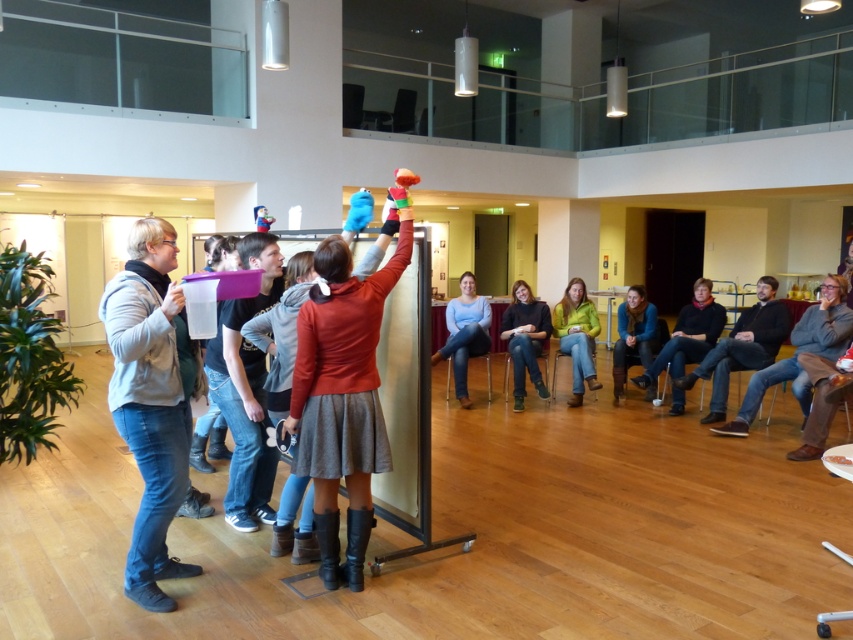
Question: Can you confirm if dark blue jeans at center is smaller than matte plastic toy at upper center?

Choices:
 (A) yes
 (B) no

Answer: (B)

Question: Can you confirm if reddish-brown leather jacket at center is thinner than blue scarf at lower right?

Choices:
 (A) yes
 (B) no

Answer: (B)

Question: Which point is farther to the camera?

Choices:
 (A) (517, 284)
 (B) (701, 292)
 (C) (387, 202)
 (D) (582, 346)

Answer: (A)

Question: Which of the following is the farthest from the observer?

Choices:
 (A) dark brown leather jacket at lower right
 (B) reddish-brown leather jacket at center
 (C) jeans at center
 (D) matte plastic toy at upper center

Answer: (C)

Question: Which object is positioned farthest from the blue scarf at lower right?

Choices:
 (A) blue jeans at center
 (B) reddish-brown leather jacket at center

Answer: (B)

Question: Does green fuzzy sweater at center appear over multicolored plush toy at upper center?

Choices:
 (A) yes
 (B) no

Answer: (B)